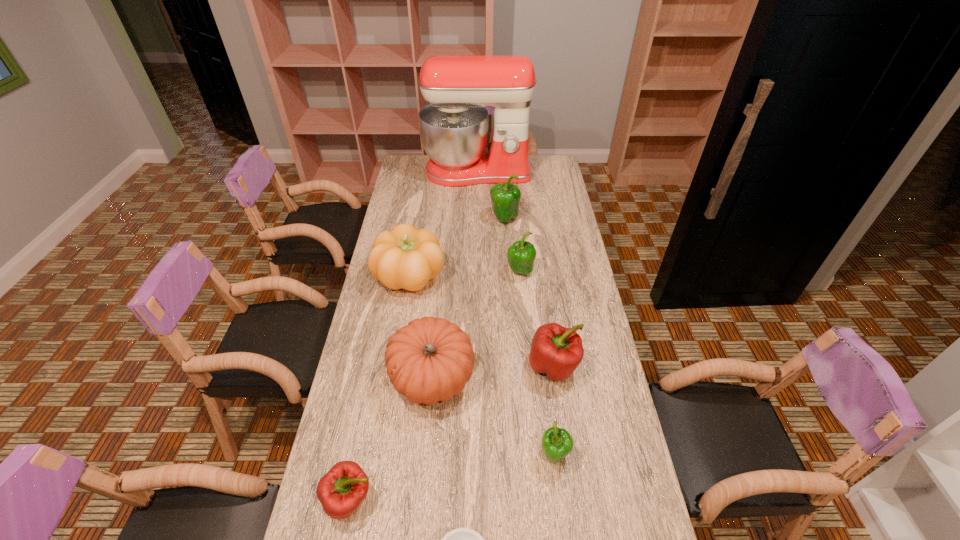
In the image, there is a desktop. Where is `vacant space at the right edge`? vacant space at the right edge is located at coordinates (542, 200).

Identify the location of vacant space at the far left corner of the desktop. (406, 157).

At what (x,y) coordinates should I click in order to perform the action: click on vacant space at the far right corner of the desktop. Please return your answer as a coordinate pair (x, y). Image resolution: width=960 pixels, height=540 pixels. Looking at the image, I should click on (556, 164).

Where is `free point between the second farthest green bell pepper and the mixer`? Image resolution: width=960 pixels, height=540 pixels. free point between the second farthest green bell pepper and the mixer is located at coordinates (498, 222).

Identify the location of unoccupied position between the orange pumpkin and the biggest green bell pepper. The width and height of the screenshot is (960, 540). (468, 298).

Where is `free space between the farther pumpkin and the nearest bell pepper`? The height and width of the screenshot is (540, 960). free space between the farther pumpkin and the nearest bell pepper is located at coordinates (380, 388).

Identify the location of the second closest object to the orange pumpkin. The image size is (960, 540). (557, 351).

Select which object appears as the sixth closest to the shorter pumpkin. Please provide its 2D coordinates. Your answer should be formatted as a tuple, i.e. [(x, y)], where the tuple contains the x and y coordinates of a point satisfying the conditions above.

[(462, 539)]

Locate an element on the screen. This screenshot has height=540, width=960. bell pepper that stands as the closest to the nearer pink bell pepper is located at coordinates (557, 443).

Identify the location of the second closest bell pepper to the farther pumpkin. The height and width of the screenshot is (540, 960). (505, 198).